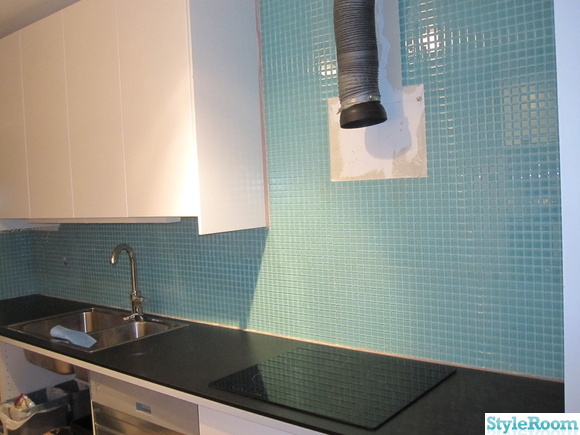
Locate an element on the screen. The width and height of the screenshot is (580, 435). wall is located at coordinates (435, 302).